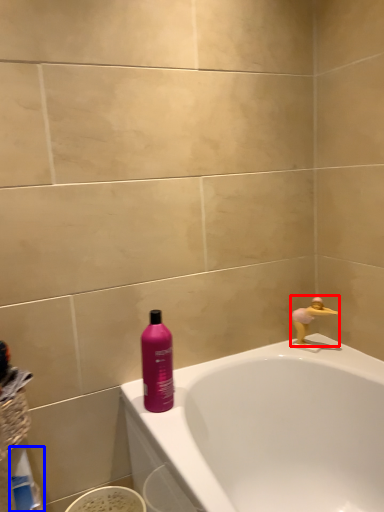
Question: Which of the following is the farthest to the observer, faucet (highlighted by a red box) or cleaning product (highlighted by a blue box)?

Choices:
 (A) faucet
 (B) cleaning product

Answer: (A)